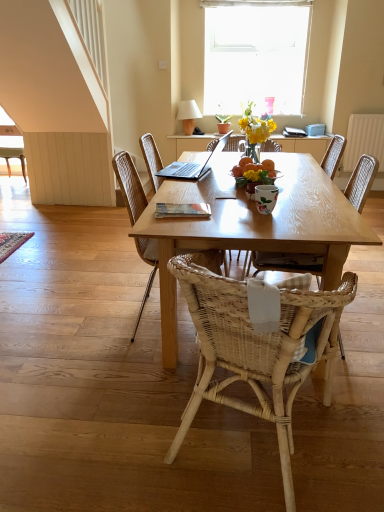
Question: Is white textured curtain at upper center facing away from white glossy coffee cup at center?

Choices:
 (A) no
 (B) yes

Answer: (A)

Question: Is white textured curtain at upper center oriented towards white glossy coffee cup at center?

Choices:
 (A) yes
 (B) no

Answer: (B)

Question: From a real-world perspective, is white textured curtain at upper center below white glossy coffee cup at center?

Choices:
 (A) no
 (B) yes

Answer: (A)

Question: Is white textured curtain at upper center bigger than white glossy coffee cup at center?

Choices:
 (A) no
 (B) yes

Answer: (B)

Question: Is white textured curtain at upper center far away from white glossy coffee cup at center?

Choices:
 (A) yes
 (B) no

Answer: (A)

Question: In terms of width, does woven wood chair at center, positioned as the second chair in back-to-front order, look wider or thinner when compared to white glass window at upper center?

Choices:
 (A) thin
 (B) wide

Answer: (B)

Question: Would you say woven wood chair at center, the 3th chair in the front-to-back sequence, is to the left or to the right of white glass window at upper center in the picture?

Choices:
 (A) left
 (B) right

Answer: (A)

Question: Considering their positions, is woven wood chair at center, the third chair viewed from the right, located in front of or behind white glass window at upper center?

Choices:
 (A) behind
 (B) front

Answer: (B)

Question: From a real-world perspective, is woven wood chair at center, acting as the second chair starting from the left, above or below white glass window at upper center?

Choices:
 (A) below
 (B) above

Answer: (A)

Question: From the image's perspective, is white textured radiator at upper right positioned above or below white glass window at upper center?

Choices:
 (A) below
 (B) above

Answer: (A)

Question: Is point (357, 124) closer or farther from the camera than point (263, 2)?

Choices:
 (A) farther
 (B) closer

Answer: (B)

Question: Is white textured radiator at upper right in front of or behind white glass window at upper center in the image?

Choices:
 (A) behind
 (B) front

Answer: (A)

Question: From a real-world perspective, relative to white glass window at upper center, is white textured radiator at upper right vertically above or below?

Choices:
 (A) above
 (B) below

Answer: (B)

Question: Considering the positions of woven wood chair at center, the 3th chair in the front-to-back sequence, and wooden book at center in the image, is woven wood chair at center, the 3th chair in the front-to-back sequence, taller or shorter than wooden book at center?

Choices:
 (A) short
 (B) tall

Answer: (B)

Question: Considering the positions of woven wood chair at center, positioned as the second chair in back-to-front order, and wooden book at center in the image, is woven wood chair at center, positioned as the second chair in back-to-front order, bigger or smaller than wooden book at center?

Choices:
 (A) big
 (B) small

Answer: (A)